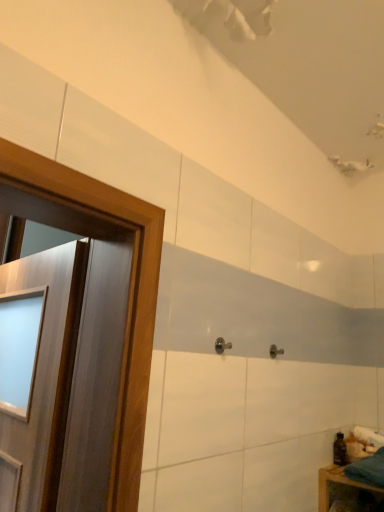
Question: Can you confirm if transparent plastic bottle at lower right is thinner than wooden door at left?

Choices:
 (A) yes
 (B) no

Answer: (A)

Question: From the image's perspective, is transparent plastic bottle at lower right located beneath wooden door at left?

Choices:
 (A) yes
 (B) no

Answer: (A)

Question: Does transparent plastic bottle at lower right lie behind wooden door at left?

Choices:
 (A) yes
 (B) no

Answer: (A)

Question: From a real-world perspective, is transparent plastic bottle at lower right located beneath wooden door at left?

Choices:
 (A) no
 (B) yes

Answer: (B)

Question: From the image's perspective, is transparent plastic bottle at lower right over wooden door at left?

Choices:
 (A) no
 (B) yes

Answer: (A)

Question: Considering the positions of wooden door at left and transparent plastic bottle at lower right in the image, is wooden door at left wider or thinner than transparent plastic bottle at lower right?

Choices:
 (A) wide
 (B) thin

Answer: (A)

Question: Is wooden door at left in front of or behind transparent plastic bottle at lower right in the image?

Choices:
 (A) front
 (B) behind

Answer: (A)

Question: Visually, is wooden door at left positioned to the left or to the right of transparent plastic bottle at lower right?

Choices:
 (A) left
 (B) right

Answer: (A)

Question: Considering the positions of point (67, 350) and point (336, 458), is point (67, 350) closer or farther from the camera than point (336, 458)?

Choices:
 (A) farther
 (B) closer

Answer: (B)

Question: Visually, is satin nickel door handle at center positioned to the left or to the right of wooden door at left?

Choices:
 (A) left
 (B) right

Answer: (B)

Question: Looking at their shapes, would you say satin nickel door handle at center is wider or thinner than wooden door at left?

Choices:
 (A) thin
 (B) wide

Answer: (A)

Question: From a real-world perspective, is satin nickel door handle at center above or below wooden door at left?

Choices:
 (A) below
 (B) above

Answer: (B)

Question: Is satin nickel door handle at center taller or shorter than wooden door at left?

Choices:
 (A) short
 (B) tall

Answer: (A)

Question: Considering the positions of point (324, 475) and point (33, 263), is point (324, 475) closer or farther from the camera than point (33, 263)?

Choices:
 (A) closer
 (B) farther

Answer: (B)

Question: Looking at their shapes, would you say teal fabric at lower right is wider or thinner than wooden door at left?

Choices:
 (A) wide
 (B) thin

Answer: (A)